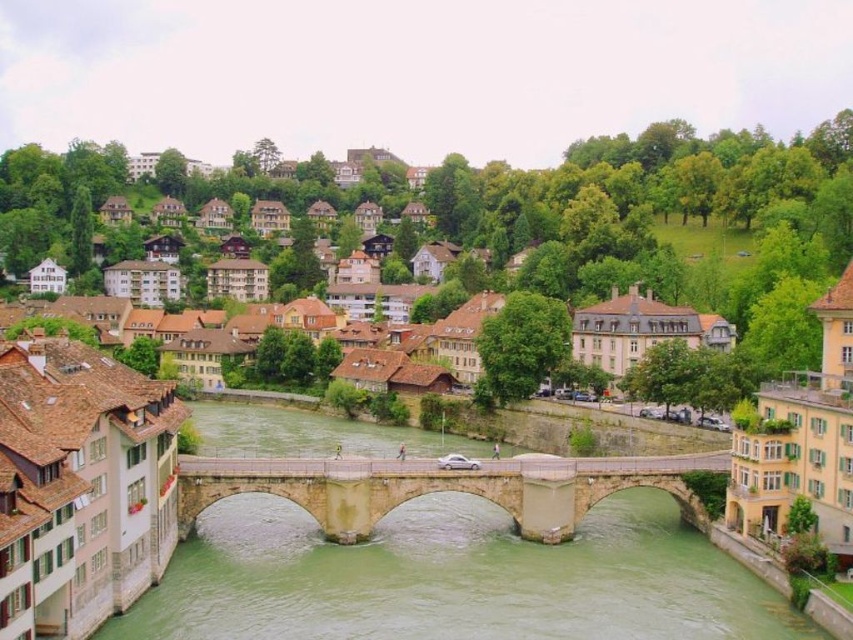
You are standing at the entrance of the town and want to cross the green stone bridge at center. Based on the coordinates provided, is the bridge positioned closer to the left or right side of the image?

The green stone bridge at center is located at point (456, 579), which places it closer to the right side of the image since the x coordinate is 0.905, indicating proximity to the right edge.